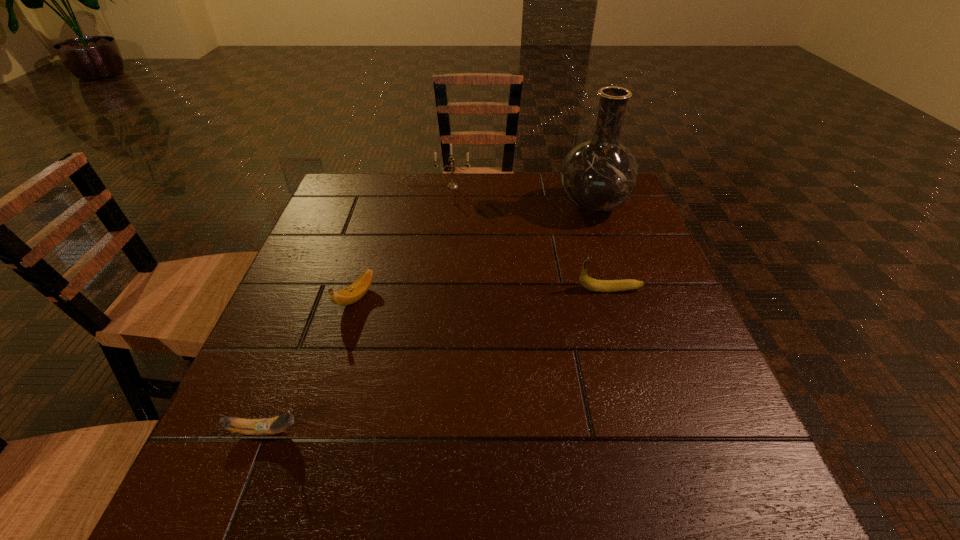
You are a GUI agent. You are given a task and a screenshot of the screen. Output one action in this format:
    pyautogui.click(x=<x>, y=<y>)
    Task: Click on the second closest object to the fourth shortest object
    The image size is (960, 540).
    Given the screenshot: What is the action you would take?
    pyautogui.click(x=351, y=294)

You are a GUI agent. You are given a task and a screenshot of the screen. Output one action in this format:
    pyautogui.click(x=<x>, y=<y>)
    Task: Click on the banana that stands as the closest to the tallest banana
    
    Given the screenshot: What is the action you would take?
    pyautogui.click(x=351, y=294)

What are the coordinates of `banana that is the second closest to the nearest object` in the screenshot? It's located at (587, 282).